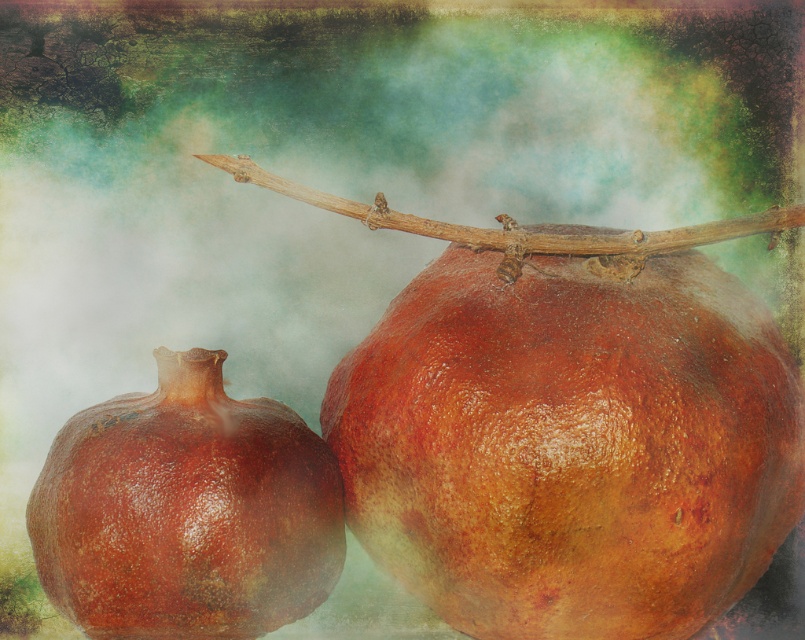
You are an artist trying to paint the scene. You want to ensure the glossy brown pomegranate at center and the brown rough branch at center are positioned correctly. Which object should appear in front of the other in your painting?

The glossy brown pomegranate at center should appear in front of the brown rough branch at center because it is closer to the viewer.

You are an artist arranging a still life composition. You have a shiny brown pomegranate at center and a brown rough branch at center. Which object would you choose if you need an item with a thicker form for structural support in your arrangement?

The brown rough branch at center is thicker than the shiny brown pomegranate at center, so it would be better for structural support.

You are arranging fruits on a table and see the glossy brown pomegranate at center and the shiny brown pomegranate at center. Which one is positioned more to the right?

The glossy brown pomegranate at center is positioned more to the right than the shiny brown pomegranate at center.